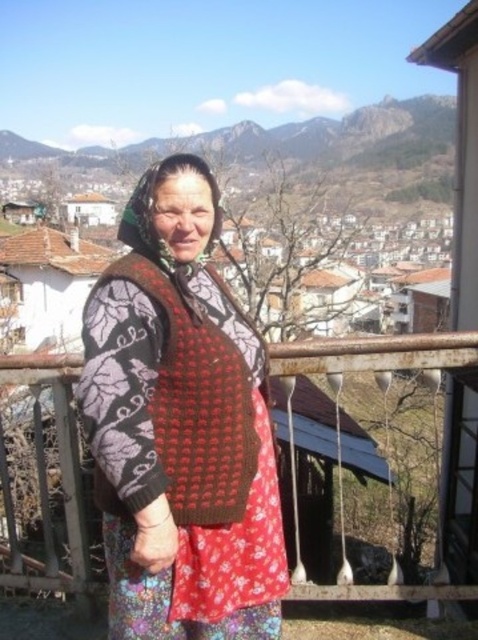
You are a photographer trying to capture the knitted wool shawl at center and the green textured mountain at upper center in the same frame. Based on their sizes in the image, which object would appear smaller in the final photo?

The knitted wool shawl at center appears smaller in the final photo because it is not as tall as the green textured mountain at upper center.

You are an architect designing a new balcony for a house. The balcony has a railing that blocks the view at the center. The knitted wool shawl at center is placed where the railing is. Can the shawl be moved to a position where it won not block the view?

The knitted wool shawl at center is located at point (x=187, y=410), which is where the railing is. To avoid blocking the view, the shawl should be moved to a position not obstructed by the railing, such as the left or right side of the balcony.